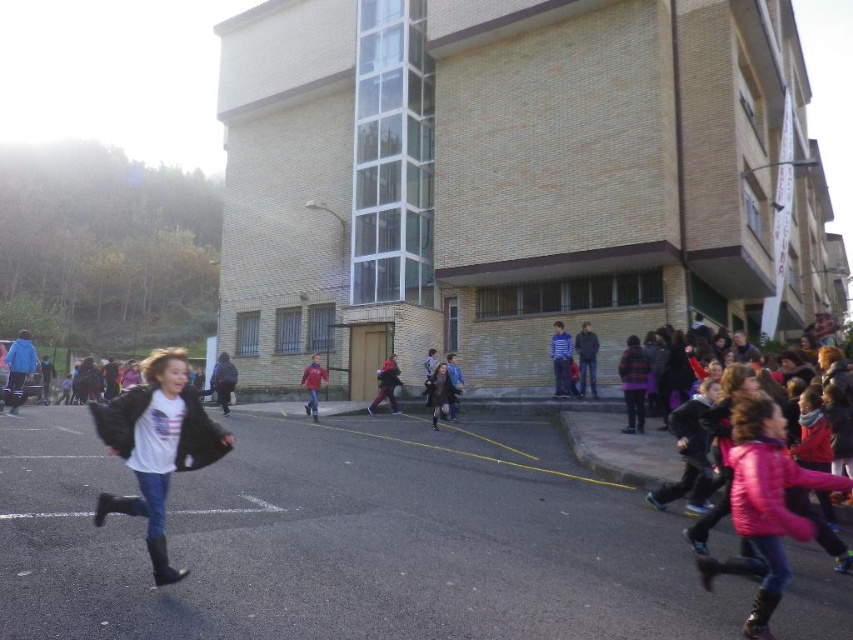
You are a photographer positioned at the starting line of the race. You want to capture both the point at coordinates point (610,483) and point (305,406) in your shot. Which point is closer to your camera?

Point (610,483) is in front of point (305,406), so it is closer to the camera.

You are a photographer trying to capture a photo of the brick building at center without any obstructions. Given that the black matte jacket at left is in the way, can you adjust your position to the right to get a clear shot?

The brick building at center is positioned over the black matte jacket at left, so moving to the right might allow you to position yourself where the jacket is no longer blocking the view of the building.